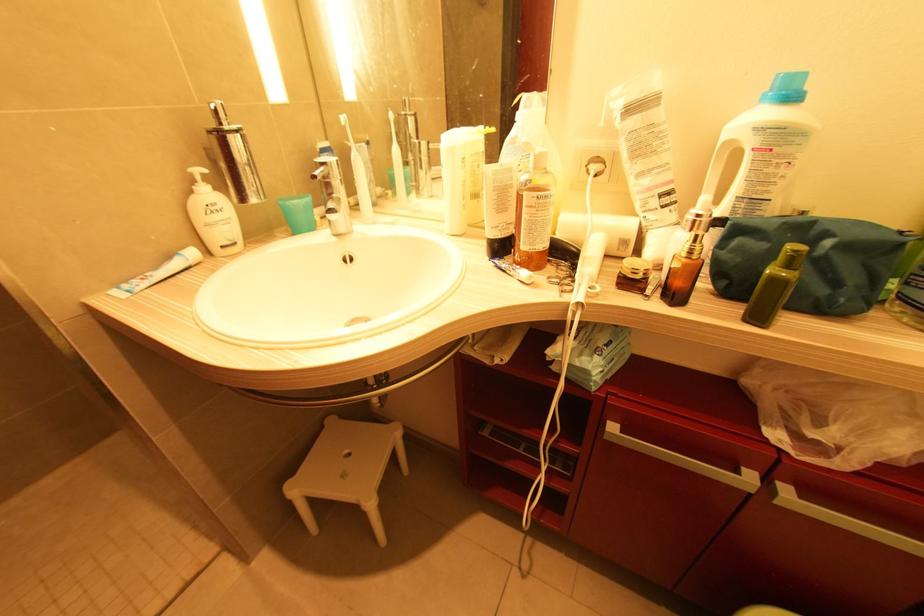
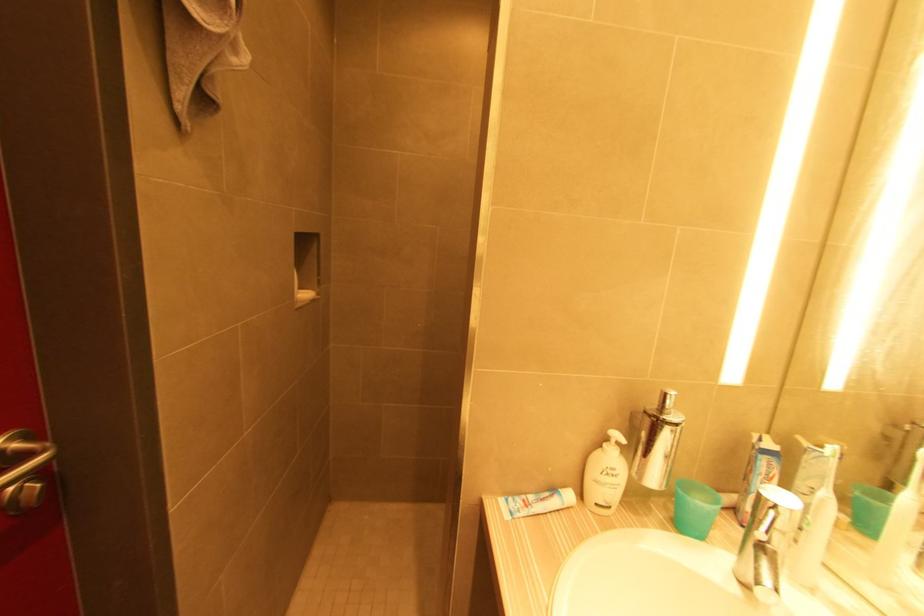
Question: The first image is from the beginning of the video and the second image is from the end. How did the camera likely rotate when shooting the video?

Choices:
 (A) Left
 (B) Right
 (C) Up
 (D) Down

Answer: (A)